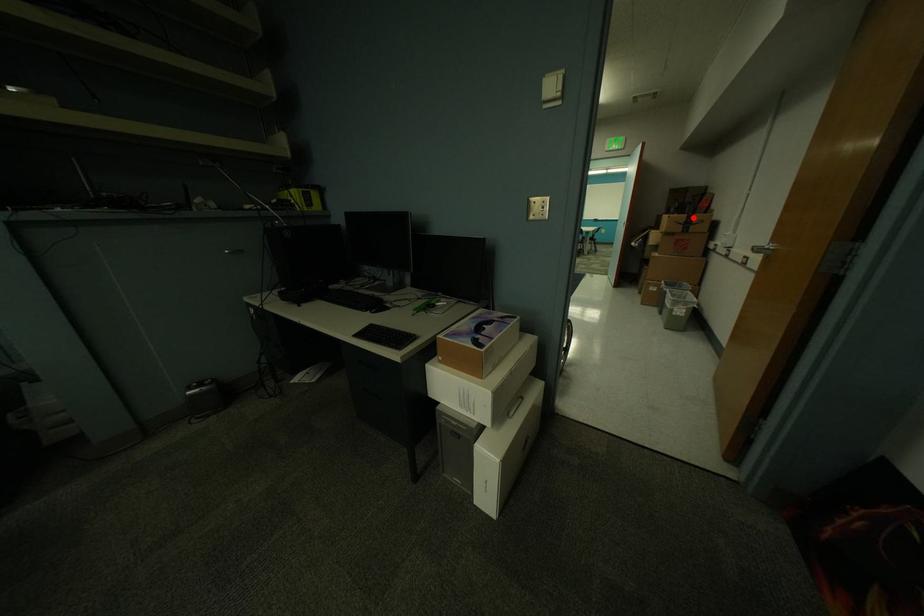
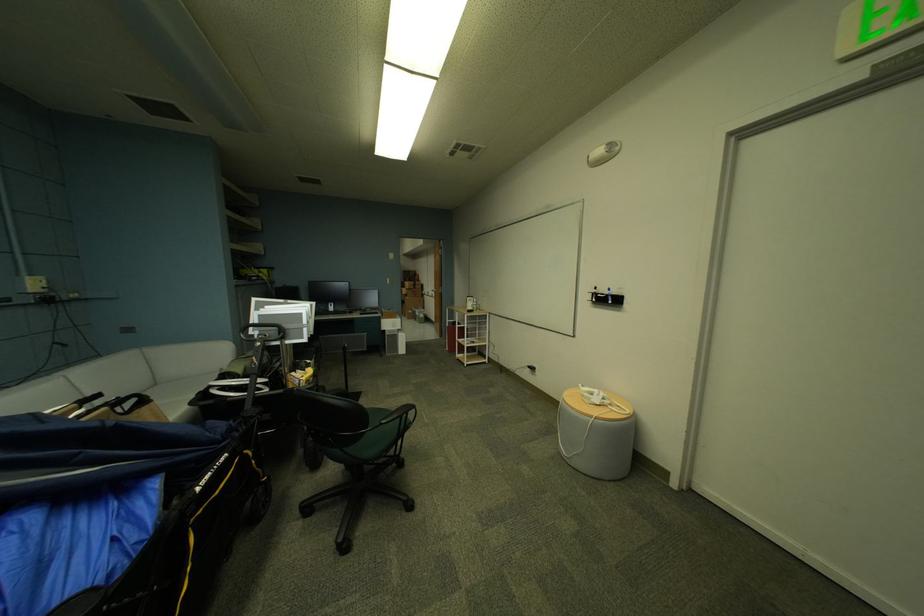
The point at the highlighted location is marked in the first image. Where is the corresponding point in the second image?

(421, 284)